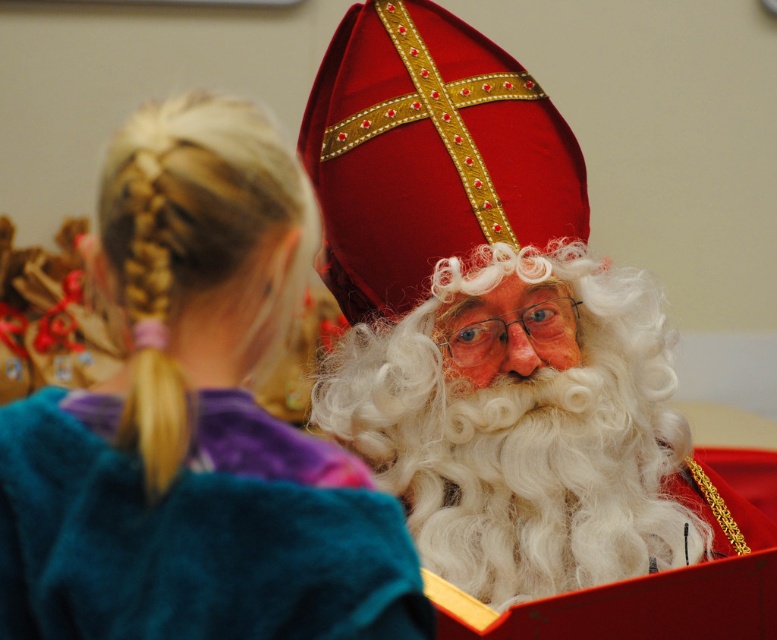
Question: Is teal fleece sweater at upper left positioned at the back of white curly hair at center?

Choices:
 (A) yes
 (B) no

Answer: (B)

Question: Does white curly hair at center appear on the right side of teal fuzzy robe at upper left?

Choices:
 (A) no
 (B) yes

Answer: (B)

Question: Is velvet red hat at upper center positioned behind teal fleece sweater at upper left?

Choices:
 (A) no
 (B) yes

Answer: (B)

Question: Among these objects, which one is farthest from the camera?

Choices:
 (A) teal fuzzy robe at upper left
 (B) teal fleece sweater at upper left

Answer: (B)

Question: Which point is closer to the camera?

Choices:
 (A) (100, 532)
 (B) (291, 602)
 (C) (375, 129)
 (D) (657, 388)

Answer: (B)

Question: Which is nearer to the teal fuzzy robe at upper left?

Choices:
 (A) teal fleece sweater at upper left
 (B) white curly hair at center

Answer: (A)